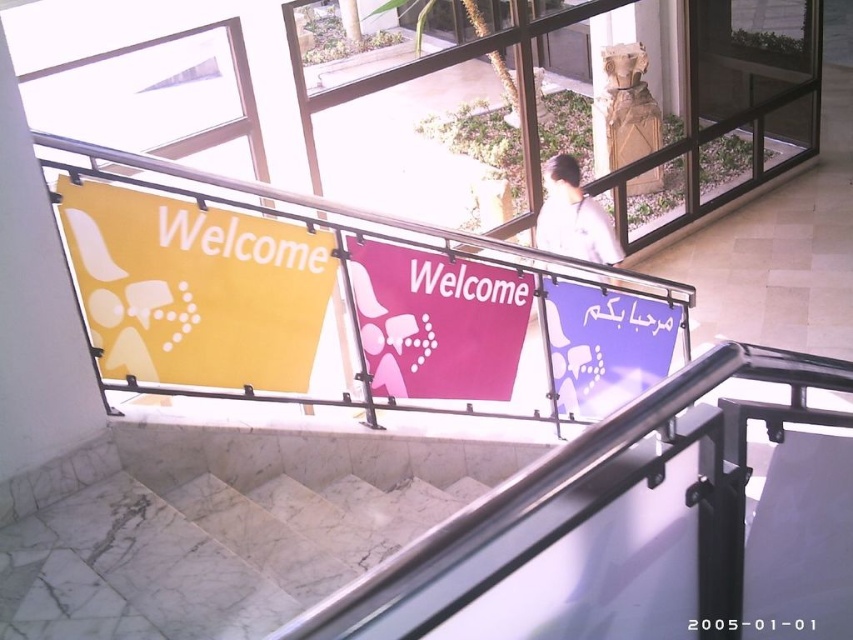
Looking at this image, you are standing at the bottom of the staircase and want to locate both the yellow matte sign at left and the purple glossy sign at upper right. According to their positions, which one is more to the left?

The yellow matte sign at left is more to the left than the purple glossy sign at upper right.

You are standing at the bottom of the staircase and want to read both the yellow matte sign at left and the pink fabric sign at center. Which sign should you approach first to read both without moving past the other?

You should approach the yellow matte sign at left first since it is closer to you. After reading it, you can then move further to read the pink fabric sign at center which is behind it.

You are standing at the bottom of the staircase and see the point marked as point [437,321]. What object is located at that point?

The point [437,321] corresponds to the pink fabric sign at center.